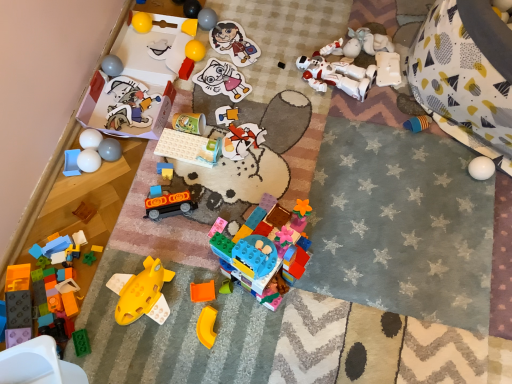
Find the location of a particular element. vacant space behind yellow rubber ball at upper center, the tenth toy from the right is located at coordinates (208, 32).